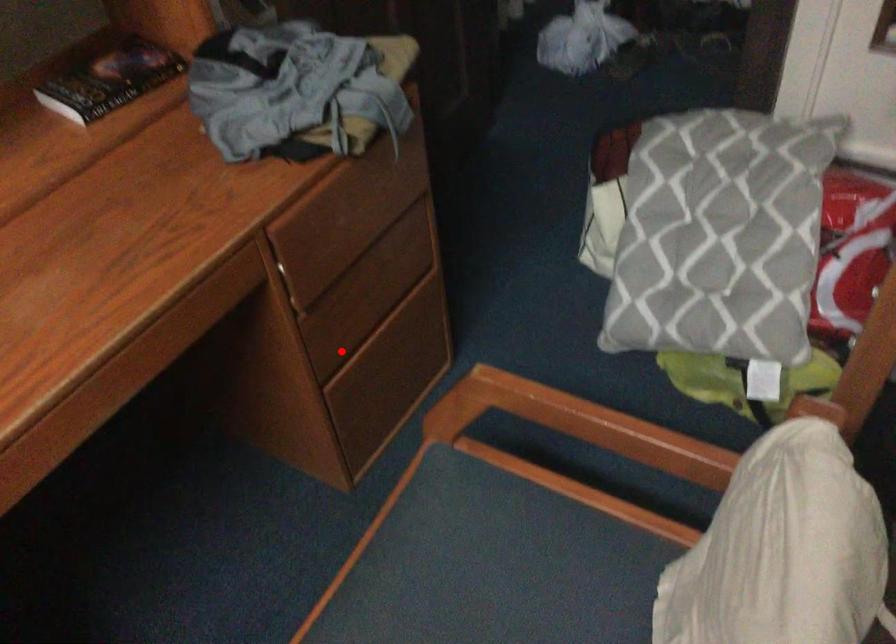
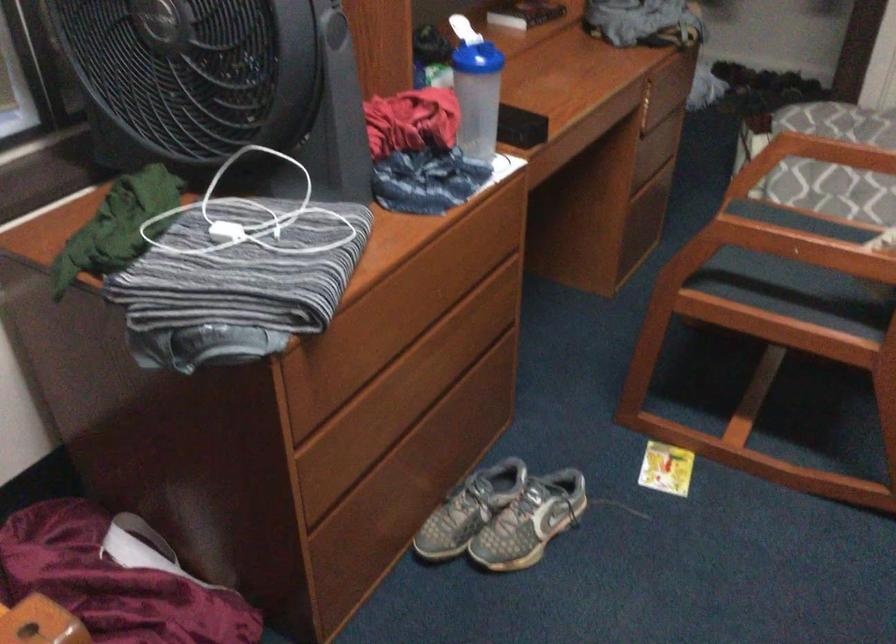
Question: I am providing you with two images of the same scene from different viewpoints. In image1, a red point is highlighted. Considering the same 3D point in image2, which of the following is correct?

Choices:
 (A) It is closer
 (B) It is farther

Answer: (B)